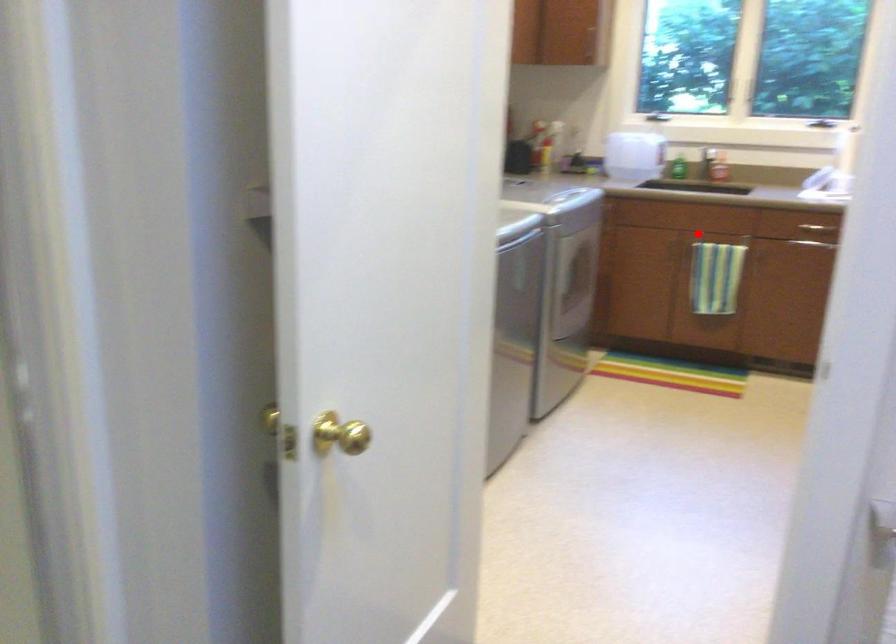
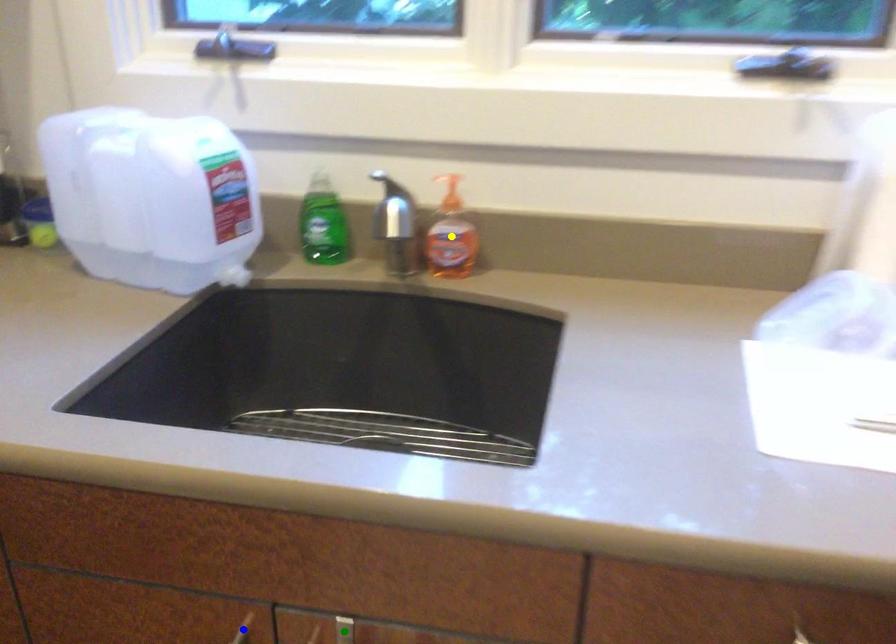
Question: I am providing you with two images of the same scene from different viewpoints. A red point is marked on the first image. You are given multiple points on the second image. Which point in image 2 represents the same 3d spot as the red point in image 1?

Choices:
 (A) yellow point
 (B) blue point
 (C) green point

Answer: (C)